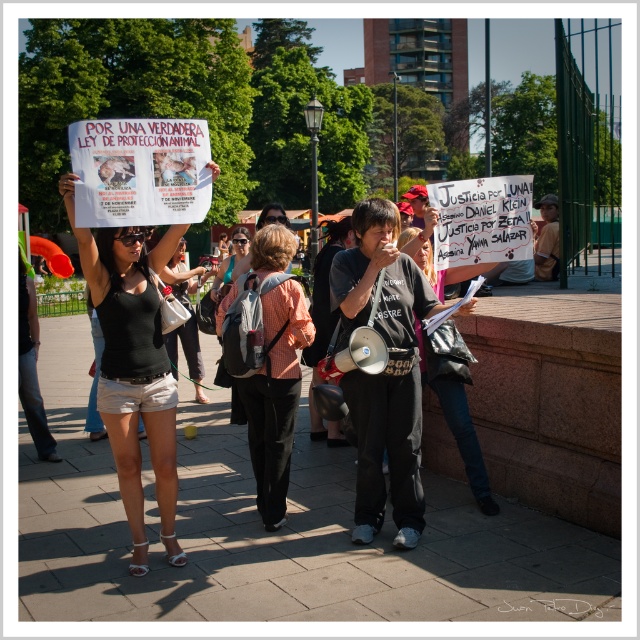
You are a photographer at the protest and want to capture both the black fabric shorts at lower left and the matte black tank top at center in your photo. Which clothing item will appear bigger in the photo?

The black fabric shorts at lower left will appear bigger in the photo because they are larger in size than the matte black tank top at center.

You are a photographer trying to capture a photo of the protesters. You want to ensure both the black fabric shorts at lower left and the orange checkered shirt at center are clearly visible in the frame. Which protester should you focus on to ensure the other remains in the background?

You should focus on the black fabric shorts at lower left because it is taller than the orange checkered shirt at center, ensuring the shorter orange checkered shirt at center stays in the background.